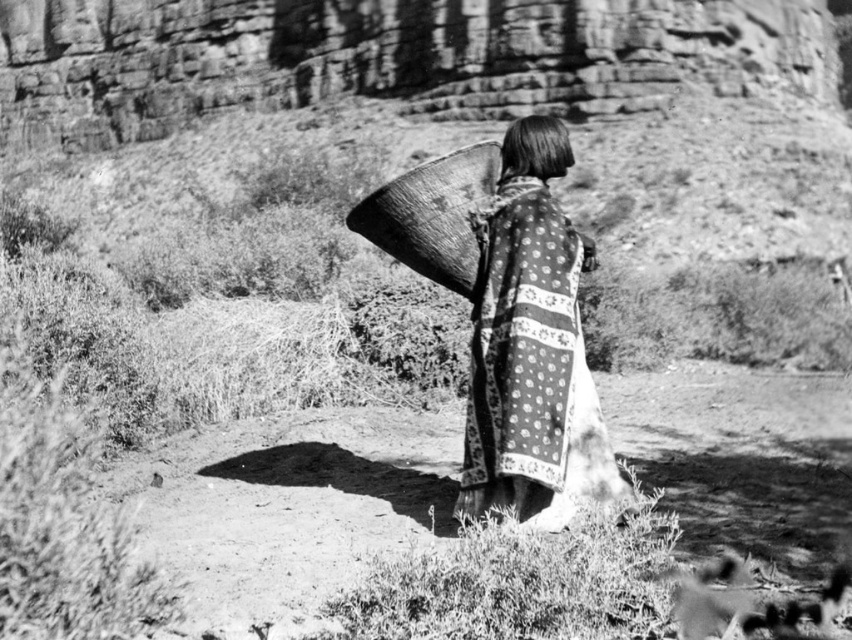
You are a photographer analyzing the composition of this black and white photo. You notice the patterned fabric shawl at center and the wooden basket at upper center. Which object occupies more vertical space in the image?

The patterned fabric shawl at center is taller than the wooden basket at upper center, so it occupies more vertical space in the image.

You are standing at the camera position and want to know how far the point at coordinates (517,193) is from you. Can you determine the distance?

The point at coordinates (517,193) is 40.53 meters away from the camera position.

Based on the scene described, which object is positioned lower in the image between the wooden basket at upper center and the smooth dark hair at center?

The wooden basket at upper center is positioned below the smooth dark hair at center, so it is lower in the image.